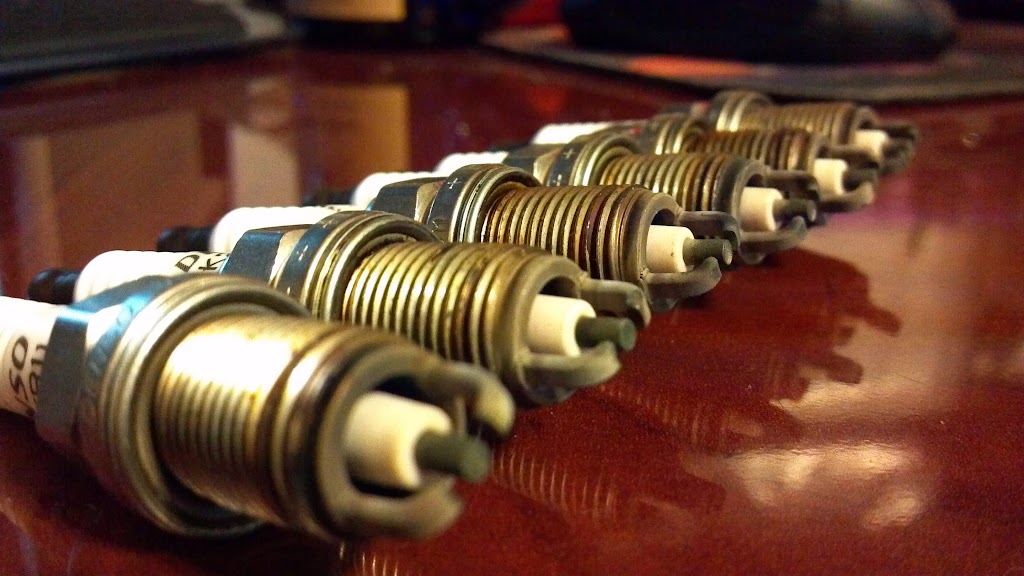
I want to click on red table, so click(x=742, y=500).